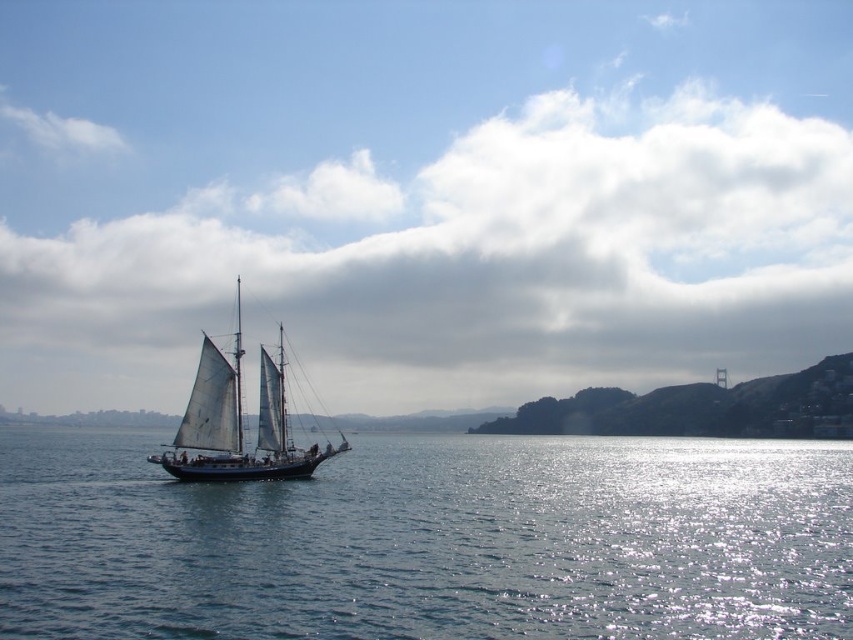
You are a sailor on the white sailboat at center and want to know if the blue water at center is directly beneath your boat. Based on the scene, can you confirm this?

Yes, the blue water at center is directly below the white sailboat at center, as described in the scene.